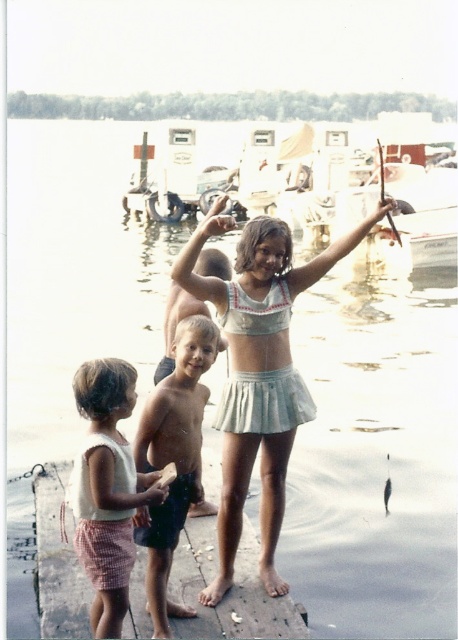
Is wooden dock at center positioned at the back of light brown skin boy at center?

Yes, it is.

Does wooden dock at center appear over light brown skin boy at center?

Incorrect, wooden dock at center is not positioned above light brown skin boy at center.

What do you see at coordinates (230, 589) in the screenshot? This screenshot has width=458, height=640. I see `wooden dock at center` at bounding box center [230, 589].

I want to click on wooden dock at center, so click(x=230, y=589).

Who is taller, wooden dock at center or white cotton tank top at lower left?

With more height is white cotton tank top at lower left.

Which is more to the left, wooden dock at center or white cotton tank top at lower left?

white cotton tank top at lower left

Does point (255, 609) come in front of point (118, 380)?

No, (255, 609) is behind (118, 380).

Locate an element on the screen. wooden dock at center is located at coordinates (230, 589).

Can you confirm if white cotton bikini top at center is shorter than wooden dock at center?

No, white cotton bikini top at center is not shorter than wooden dock at center.

Is white cotton bikini top at center smaller than wooden dock at center?

No.

Is point (272, 264) behind point (257, 611)?

Yes, point (272, 264) is behind point (257, 611).

At what (x,y) coordinates should I click in order to perform the action: click on white cotton bikini top at center. Please return your answer as a coordinate pair (x, y). The image size is (458, 640). Looking at the image, I should click on (259, 372).